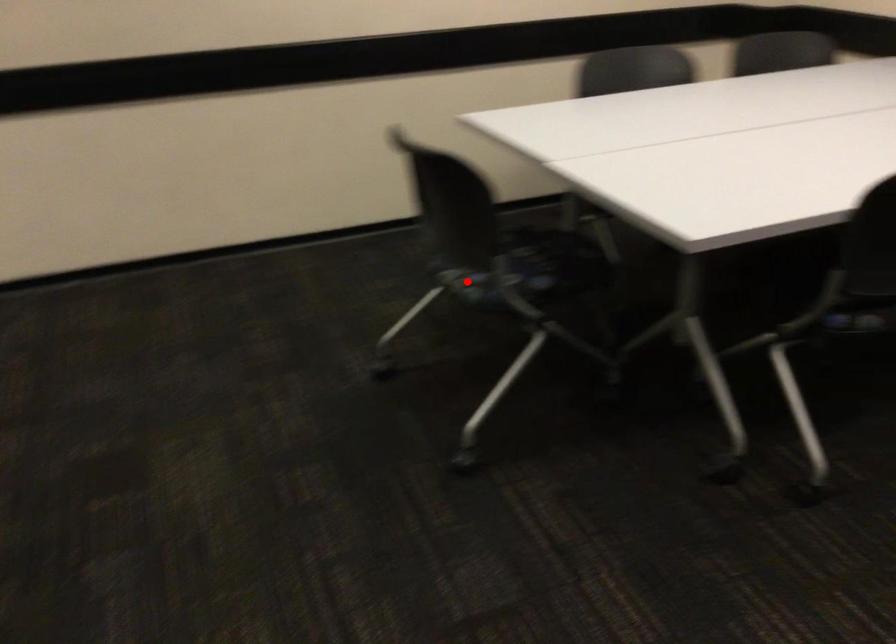
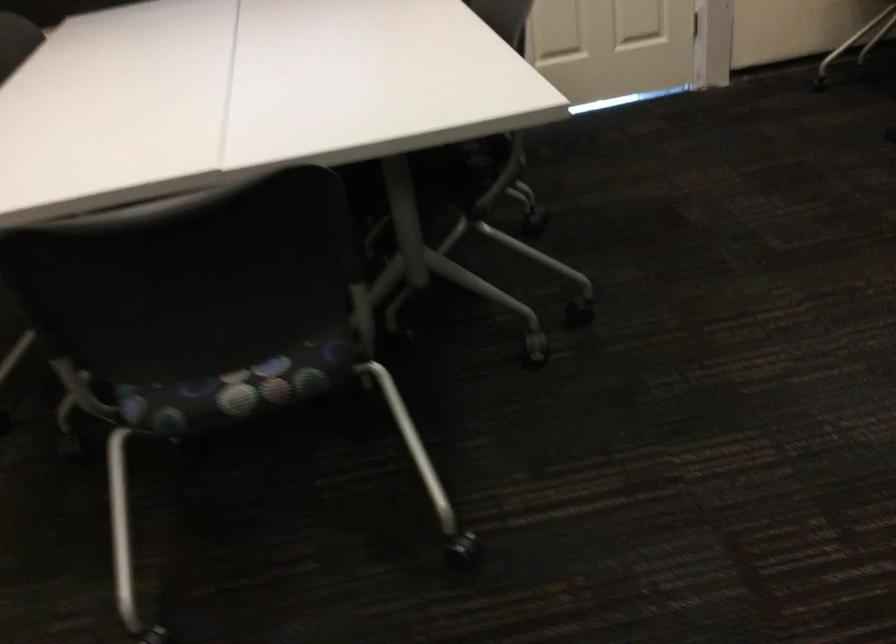
Question: I am providing you with two images of the same scene from different viewpoints. Image1 has a red point marked. In image2, the corresponding 3D location appears at what relative position? Reply with the corresponding letter.

Choices:
 (A) Closer
 (B) Farther

Answer: (A)